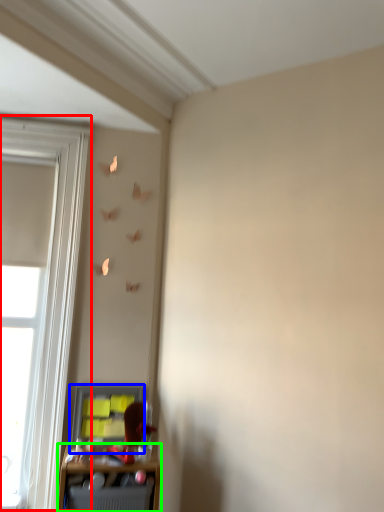
Question: Which object is positioned farthest from window (highlighted by a red box)? Select from cabinet (highlighted by a blue box) and shelf (highlighted by a green box).

Choices:
 (A) cabinet
 (B) shelf

Answer: (B)